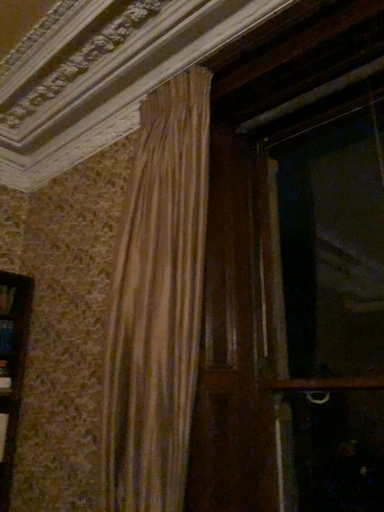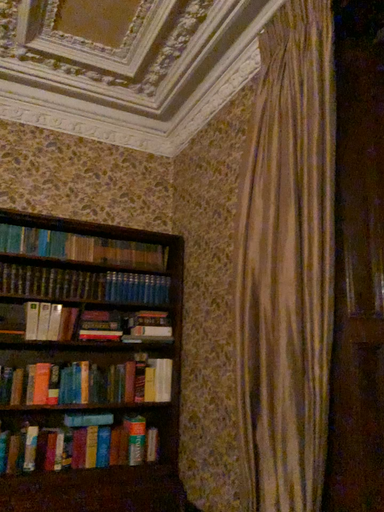
Question: How did the camera likely rotate when shooting the video?

Choices:
 (A) rotated left
 (B) rotated right

Answer: (A)